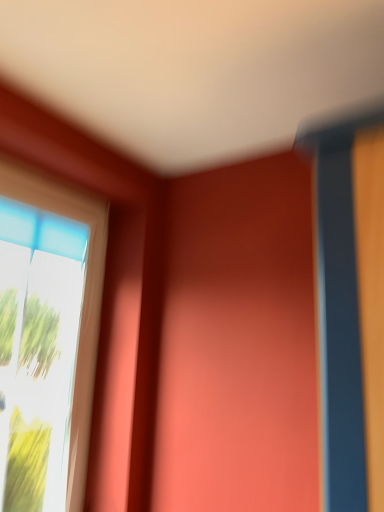
You are a GUI agent. You are given a task and a screenshot of the screen. Output one action in this format:
    pyautogui.click(x=<x>, y=<y>)
    Task: Click on the clear glass window at left
    
    Given the screenshot: What is the action you would take?
    [x=47, y=339]

Describe the element at coordinates (47, 339) in the screenshot. The width and height of the screenshot is (384, 512). I see `clear glass window at left` at that location.

Find the location of a particular element. The height and width of the screenshot is (512, 384). clear glass window at left is located at coordinates (47, 339).